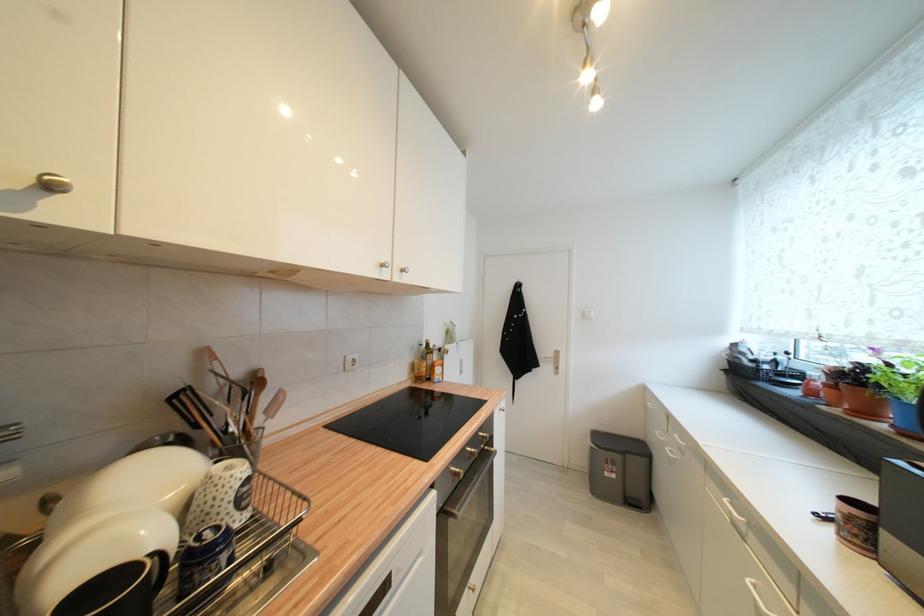
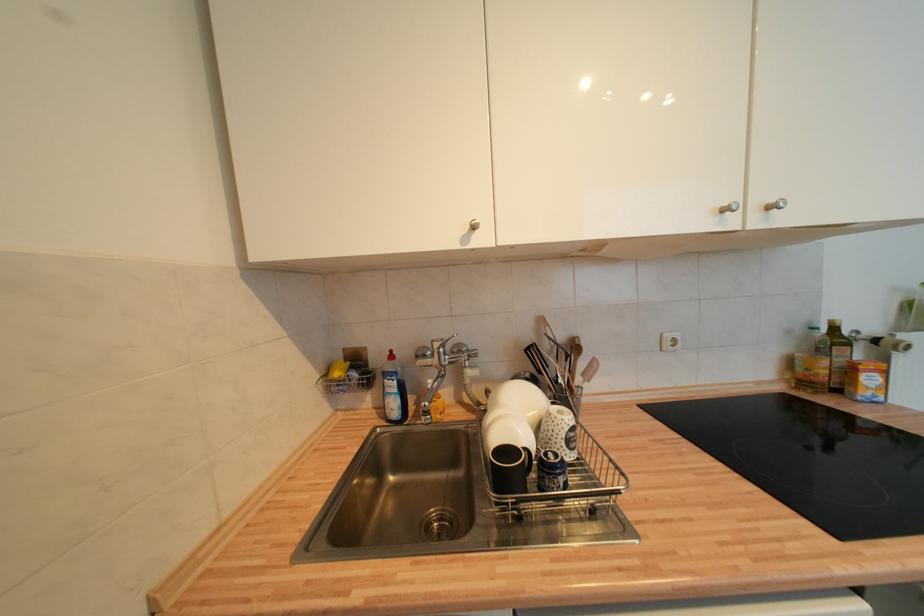
Locate, in the second image, the point that corresponds to point (432, 346) in the first image.

(840, 331)